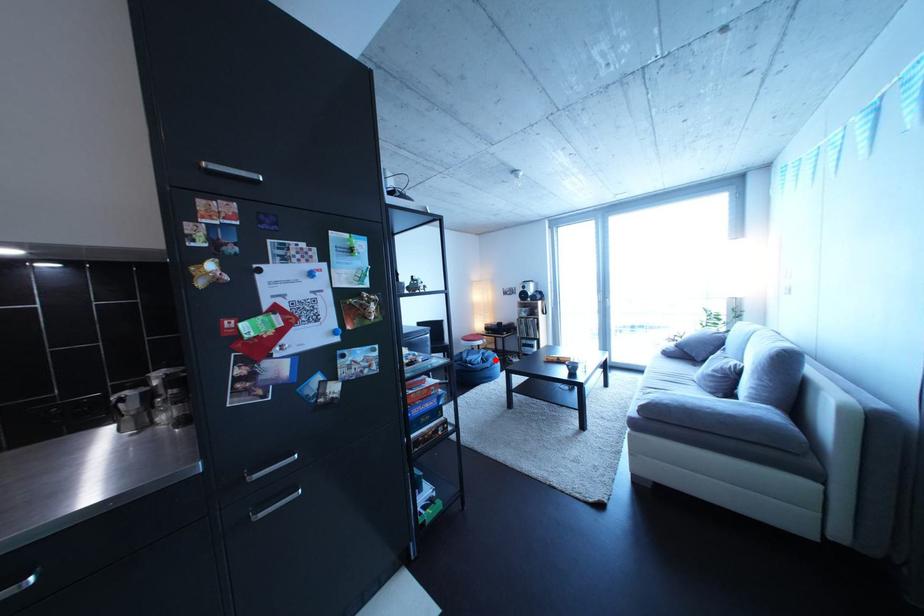
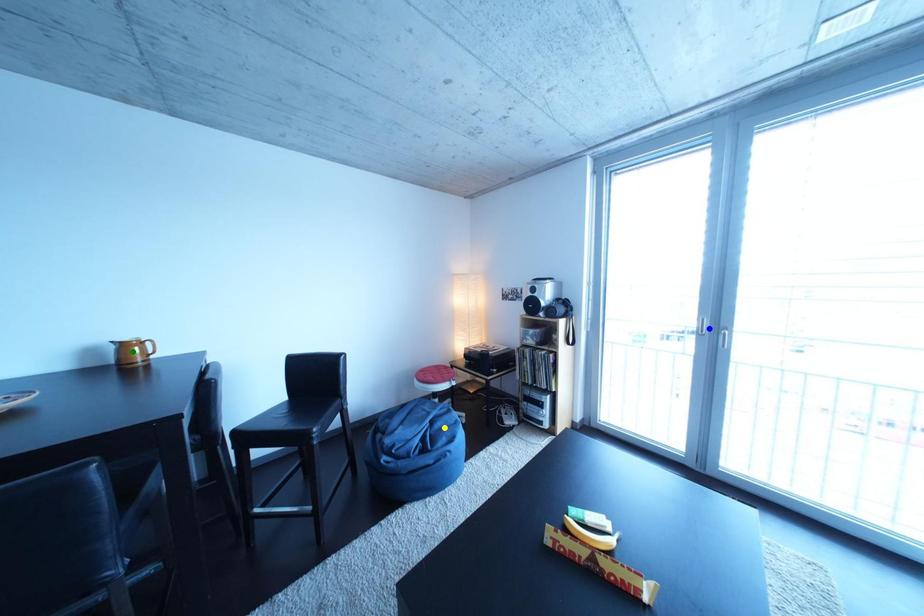
Question: I am providing you with two images of the same scene from different viewpoints. A red point is marked on the first image. You are given multiple points on the second image. Which point in image 2 represents the same 3d spot as the red point in image 1?

Choices:
 (A) green point
 (B) blue point
 (C) yellow point

Answer: (C)